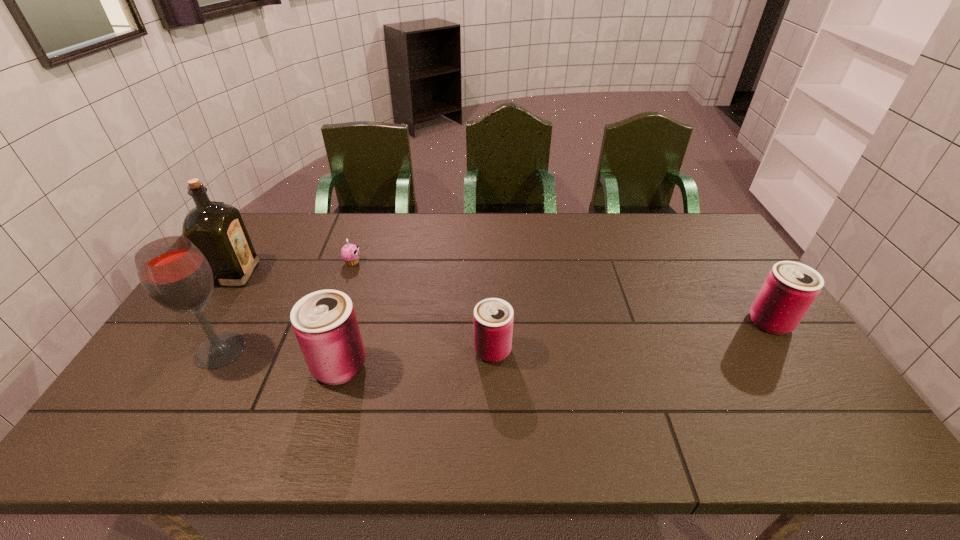
Find the location of a particular element. The width and height of the screenshot is (960, 540). free space that satisfies the following two spatial constraints: 1. on the label of the second shortest can; 2. on the left side of the liquor is located at coordinates (204, 322).

Identify the location of vacant space that satisfies the following two spatial constraints: 1. on the label of the liquor; 2. on the left side of the second tallest can. The width and height of the screenshot is (960, 540). (204, 322).

This screenshot has height=540, width=960. What are the coordinates of `vacant space that satisfies the following two spatial constraints: 1. on the label of the fifth object from left to right; 2. on the right side of the liquor` in the screenshot? It's located at (186, 350).

I want to click on free space that satisfies the following two spatial constraints: 1. on the label of the liquor; 2. on the right side of the second tallest can, so click(204, 322).